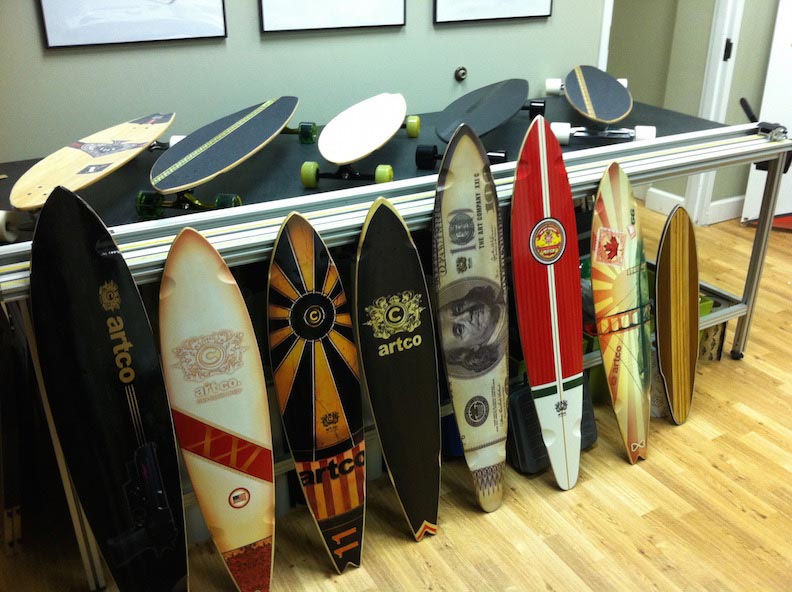
I want to click on framed pictures, so click(x=193, y=24), click(x=340, y=2), click(x=489, y=6).